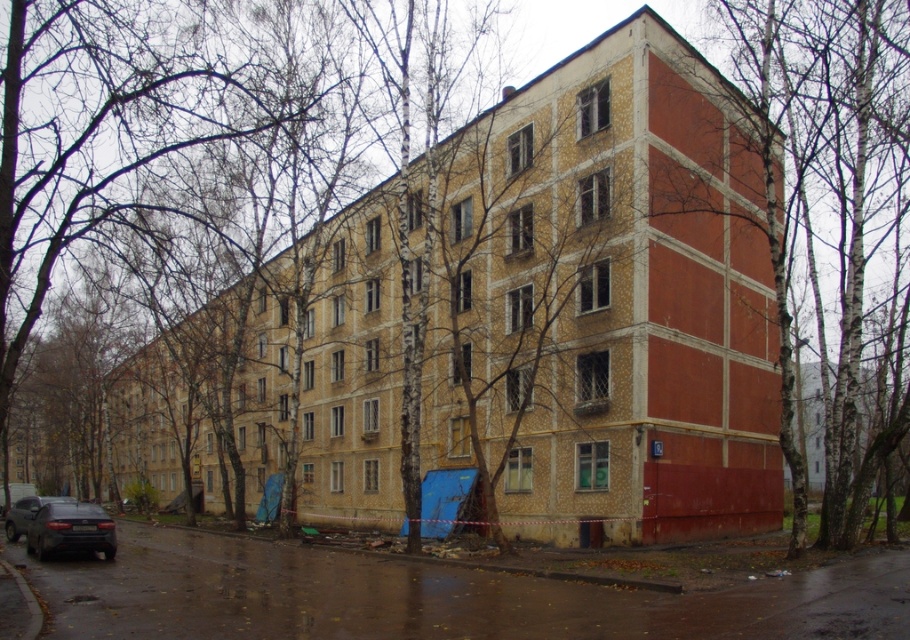
You are standing in front of the residential building and want to park your car. You see a smooth bark tree at center and a dark gray metallic car at lower left. Which object is closer to the entrance of the building?

The dark gray metallic car at lower left is closer to the entrance of the building because it is positioned on the left side of the smooth bark tree at center, which is further away.

You are a delivery person trying to park your dark gray metallic car at lower left near the smooth bark tree at center. Considering the space between them, can you safely park your car there without touching the tree?

The smooth bark tree at center might be wider than dark gray metallic car at lower left, so there is a possibility that the tree could extend into the parking space. To avoid damaging the tree or the car, it would be safer to park elsewhere or ensure sufficient clearance.